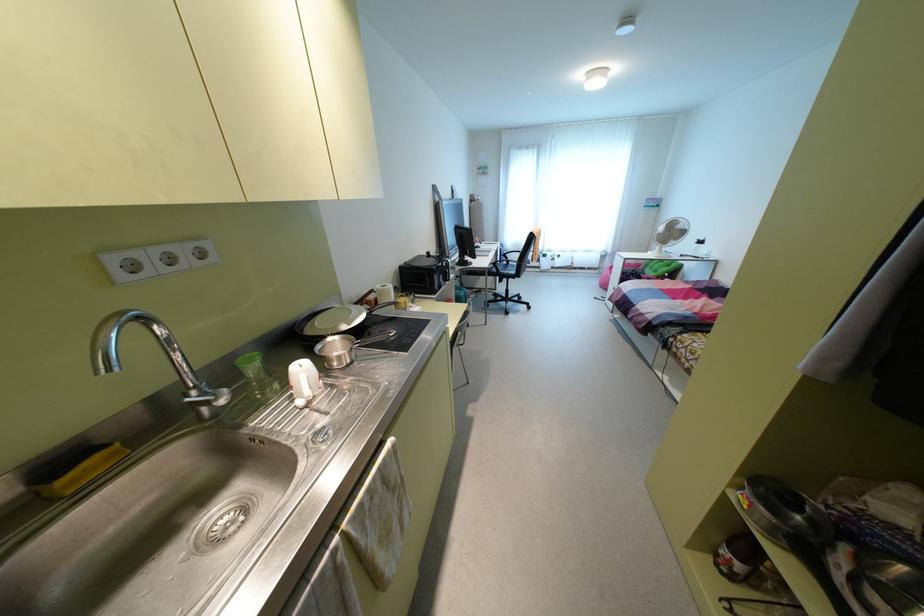
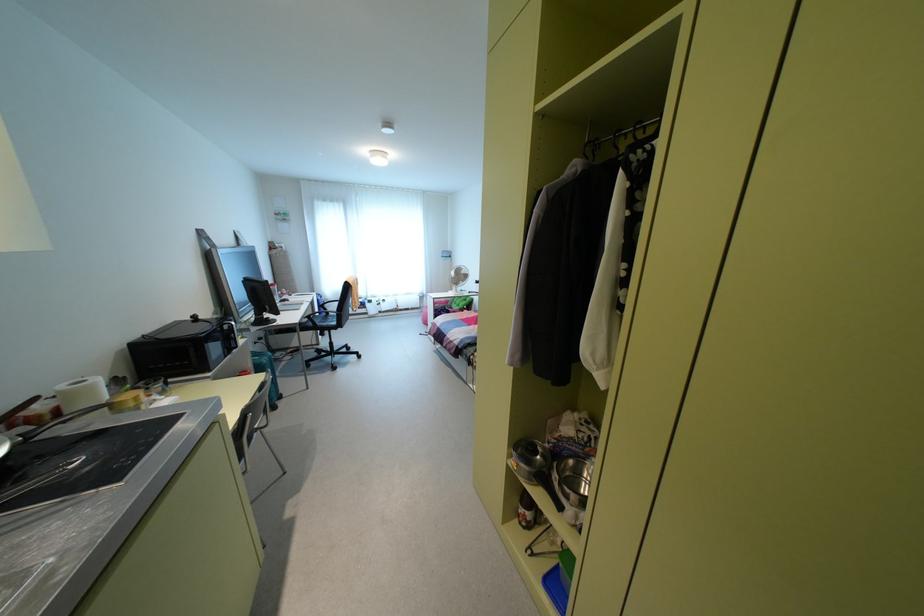
Where in the second image is the point corresponding to the point at 808,520 from the first image?

(541, 456)